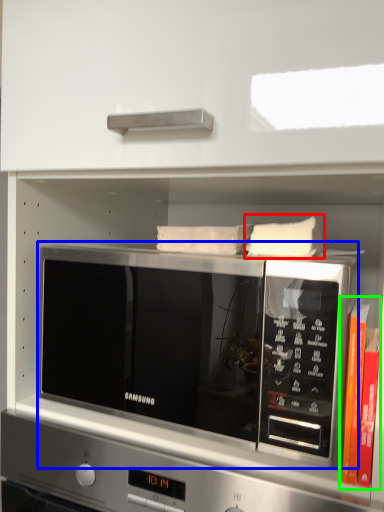
Question: Considering the real-world distances, which object is farthest from pillow (highlighted by a red box)? microwave oven (highlighted by a blue box) or book (highlighted by a green box)?

Choices:
 (A) microwave oven
 (B) book

Answer: (A)